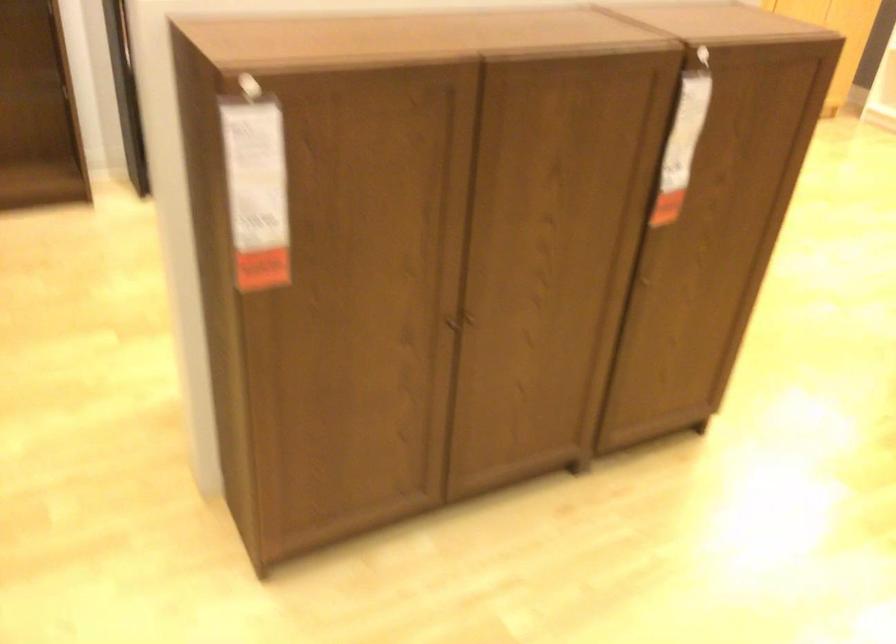
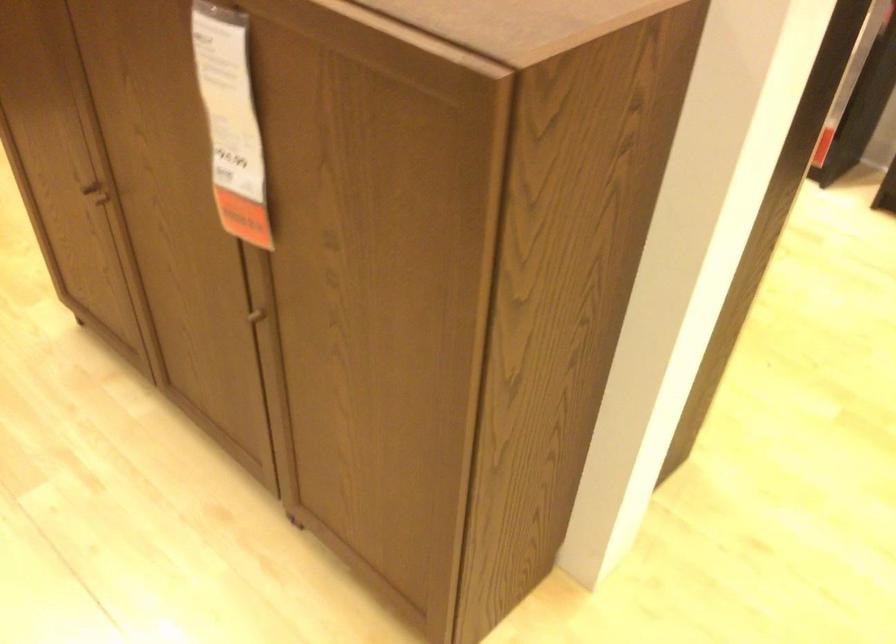
Find the pixel in the second image that matches point 643,279 in the first image.

(262, 314)